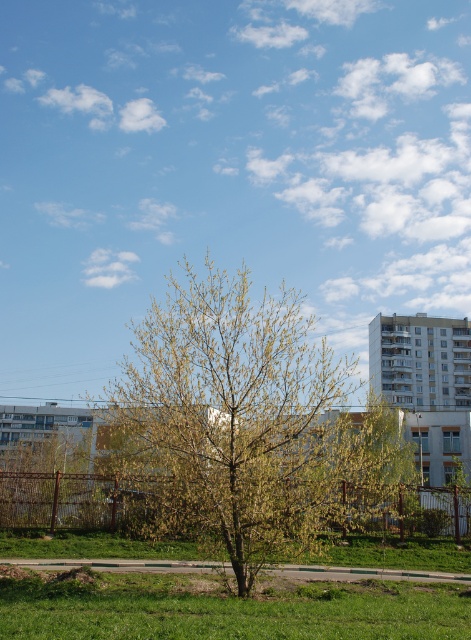
Question: Does green leafy tree at center appear under green grassy at lower center?

Choices:
 (A) yes
 (B) no

Answer: (B)

Question: Is the position of green leafy tree at center more distant than that of green grassy at lower center?

Choices:
 (A) no
 (B) yes

Answer: (B)

Question: Among these points, which one is nearest to the camera?

Choices:
 (A) (294, 515)
 (B) (48, 577)

Answer: (A)

Question: Does green leafy tree at center appear on the left side of green grassy at lower center?

Choices:
 (A) yes
 (B) no

Answer: (A)